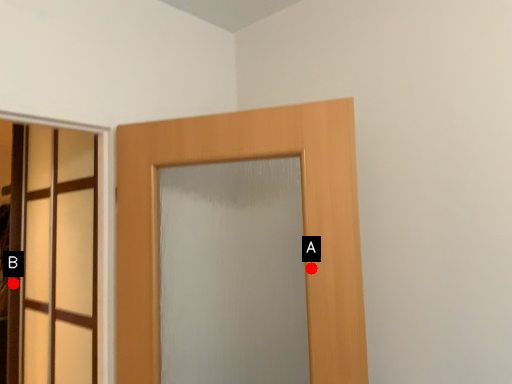
Question: Two points are circled on the image, labeled by A and B beside each circle. Which point is farther to the camera?

Choices:
 (A) A is further
 (B) B is further

Answer: (B)